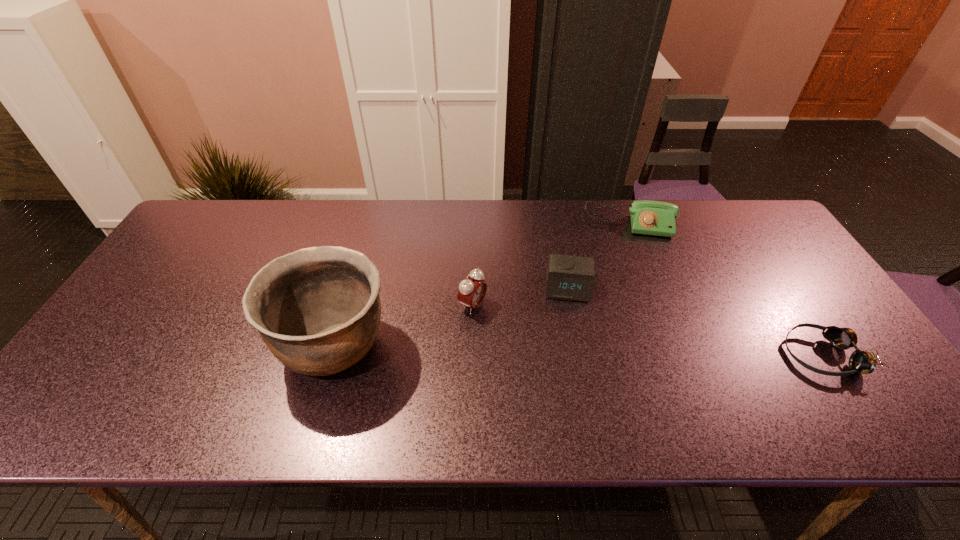
I want to click on vacant space situated 0.370m on the left of the tallest object, so click(x=129, y=346).

Image resolution: width=960 pixels, height=540 pixels. Identify the location of vacant area situated through the lenses of the goggles. (641, 355).

Where is `vacant space located 0.180m through the lenses of the goggles`? vacant space located 0.180m through the lenses of the goggles is located at coordinates (711, 355).

I want to click on free point located through the lenses of the goggles, so click(636, 355).

Where is `vacant space located 0.340m on the dial of the farthest object`? This screenshot has height=540, width=960. vacant space located 0.340m on the dial of the farthest object is located at coordinates (634, 322).

Image resolution: width=960 pixels, height=540 pixels. I want to click on vacant space located on the dial of the farthest object, so click(630, 282).

Where is `free space located 0.130m on the dial of the farthest object`? free space located 0.130m on the dial of the farthest object is located at coordinates (629, 267).

The image size is (960, 540). I want to click on vacant position located 0.100m on the clock face of the second tallest object, so click(517, 328).

I want to click on free space located 0.120m on the clock face of the second tallest object, so click(525, 332).

Where is `free space located on the clock face of the second tallest object`? The height and width of the screenshot is (540, 960). free space located on the clock face of the second tallest object is located at coordinates (517, 328).